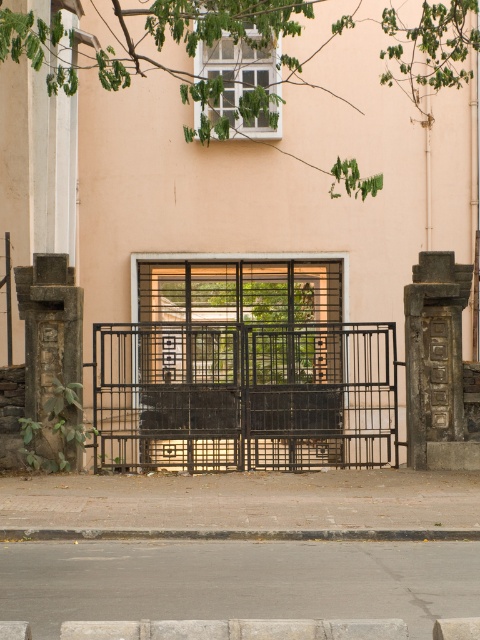
You are standing at the entrance of the building and want to step onto the gray concrete pavement at lower center. Is the black metal gate at center blocking your path to the pavement?

The black metal gate at center is taller than gray concrete pavement at lower center, so it may block your path depending on its open position. However, since the gate is partially open, you can step onto the gray concrete pavement at lower center by moving through the open part of the gate.

You are standing at the entrance of the building and want to know which of the two points, point (200, 374) or point (32, 532), is closer to you. Can you determine this based on the image?

Point (200, 374) is closer to you than point (32, 532) because it is further to the viewer according to the description.